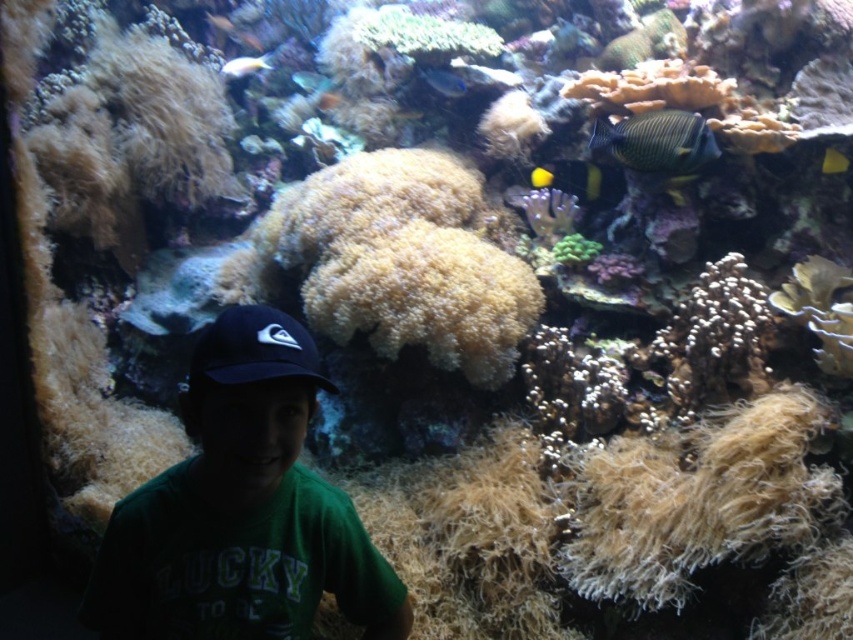
Please describe the position of the green matte shirt at center in the underwater scene using coordinates. The scene includes vibrant corals and a person in a dark baseball cap and green T shirt.

The green matte shirt at center is located at the coordinates point (241, 509).

You are a marine biologist observing the aquarium. You notice the green matte shirt at center and the yellow matte fish at center. Which object is taller?

The green matte shirt at center is taller than the yellow matte fish at center.

In the scene shown: You are a visitor at the aquarium and notice the green matte shirt at center and the yellow matte fish at center. Which one is closer to you?

The green matte shirt at center is closer to you because it is in front of the yellow matte fish at center.